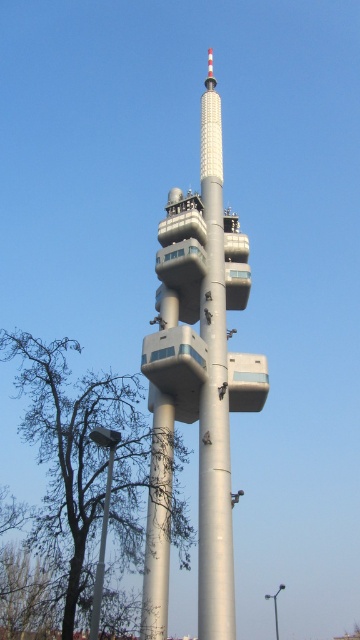
Question: Which object is positioned farthest from the metallic gray pole at lower left?

Choices:
 (A) brown leafless tree at lower left
 (B) silver metallic tower at center

Answer: (B)

Question: Does silver metallic tower at center appear on the right side of brown leafless tree at lower left?

Choices:
 (A) yes
 (B) no

Answer: (A)

Question: Is silver metallic tower at center further to the viewer compared to brown leafless tree at lower left?

Choices:
 (A) no
 (B) yes

Answer: (B)

Question: Does silver metallic tower at center appear over metallic gray pole at lower left?

Choices:
 (A) yes
 (B) no

Answer: (A)

Question: Among these points, which one is farthest from the camera?

Choices:
 (A) [189, 538]
 (B) [95, 636]
 (C) [165, 628]

Answer: (A)

Question: Which object appears closest to the camera in this image?

Choices:
 (A) metallic gray pole at lower left
 (B) brown leafless tree at lower left
 (C) silver metallic tower at center

Answer: (A)